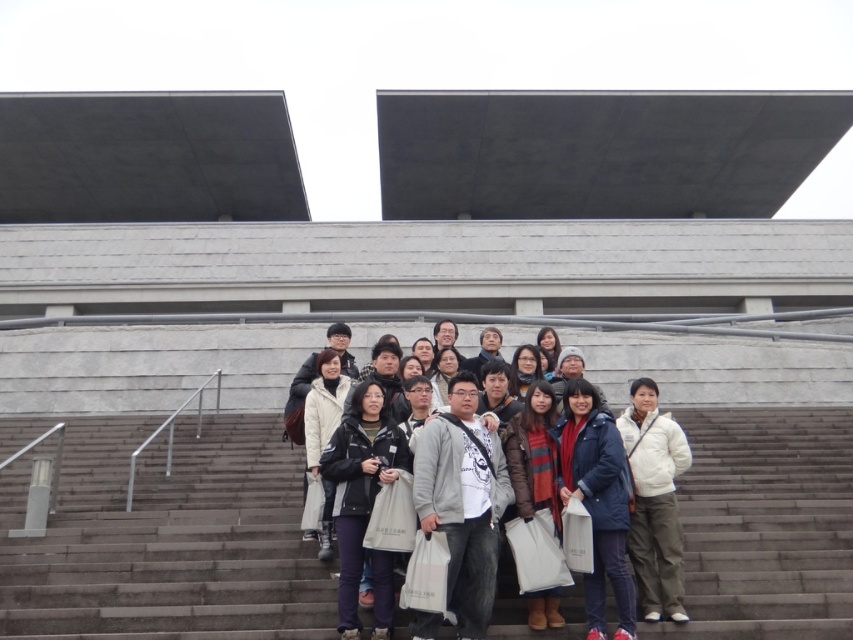
Which of these two, gray concrete stairs at center or dark blue jeans at center, stands shorter?

Standing shorter between the two is gray concrete stairs at center.

Between gray concrete stairs at center and dark blue jeans at center, which one has more height?

Standing taller between the two is dark blue jeans at center.

Does point (846, 560) come in front of point (363, 502)?

No, it is behind (363, 502).

This screenshot has width=853, height=640. I want to click on gray concrete stairs at center, so click(x=165, y=538).

Does white cotton jacket at center have a lesser height compared to dark blue jeans at center?

In fact, white cotton jacket at center may be taller than dark blue jeans at center.

Is white cotton jacket at center below dark blue jeans at center?

Actually, white cotton jacket at center is above dark blue jeans at center.

What are the coordinates of `white cotton jacket at center` in the screenshot? It's located at click(x=415, y=372).

The height and width of the screenshot is (640, 853). I want to click on white cotton jacket at center, so click(x=415, y=372).

Which is behind, point (32, 595) or point (524, 458)?

The point (524, 458) is more distant.

Can you confirm if gray concrete stairs at center is taller than brown leather jacket at center?

Incorrect, gray concrete stairs at center's height is not larger of brown leather jacket at center's.

What do you see at coordinates (165, 538) in the screenshot? This screenshot has height=640, width=853. I see `gray concrete stairs at center` at bounding box center [165, 538].

The height and width of the screenshot is (640, 853). What are the coordinates of `gray concrete stairs at center` in the screenshot? It's located at click(165, 538).